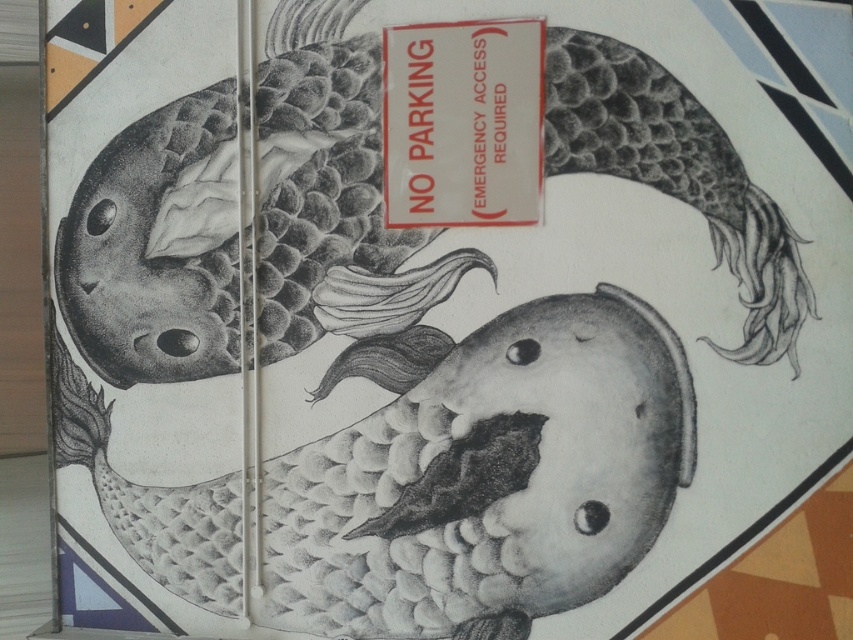
Is point (108, 259) less distant than point (476, 84)?

No, (108, 259) is behind (476, 84).

Looking at this image, is gray textured fish at center closer to camera compared to white paper sign at upper center?

Yes.

Who is more distant from viewer, (300, 228) or (399, 42)?

Point (300, 228)

Locate an element on the screen. This screenshot has height=640, width=853. gray textured fish at center is located at coordinates (155, 248).